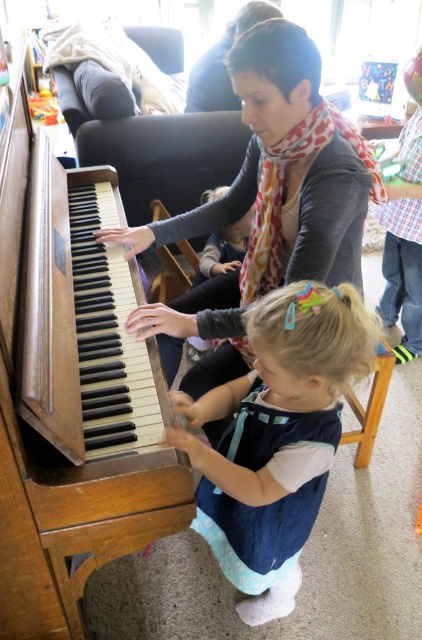
Does point (51, 426) come farther from viewer compared to point (143, 326)?

No, (51, 426) is closer to viewer.

Is wooden piano at left positioned behind matte gray sweater at center?

No, it is not.

Between point (48, 420) and point (276, 65), which one is positioned in front?

Positioned in front is point (48, 420).

Identify the location of wooden piano at left. The image size is (422, 640). (59, 412).

Which is behind, point (221, 212) or point (343, 440)?

The point (343, 440) is behind.

Between matte gray sweater at center and wooden stool at lower center, which one appears on the right side from the viewer's perspective?

Positioned to the right is wooden stool at lower center.

Find the location of `matte gray sweater at center`. matte gray sweater at center is located at coordinates [x=270, y=198].

Is wooden piano at left further to the viewer compared to light blue denim dress at center?

That is False.

Is wooden piano at left thinner than light blue denim dress at center?

In fact, wooden piano at left might be wider than light blue denim dress at center.

Between point (78, 620) and point (205, 202), which one is positioned in front?

Point (78, 620) is in front.

I want to click on wooden piano at left, so click(x=59, y=412).